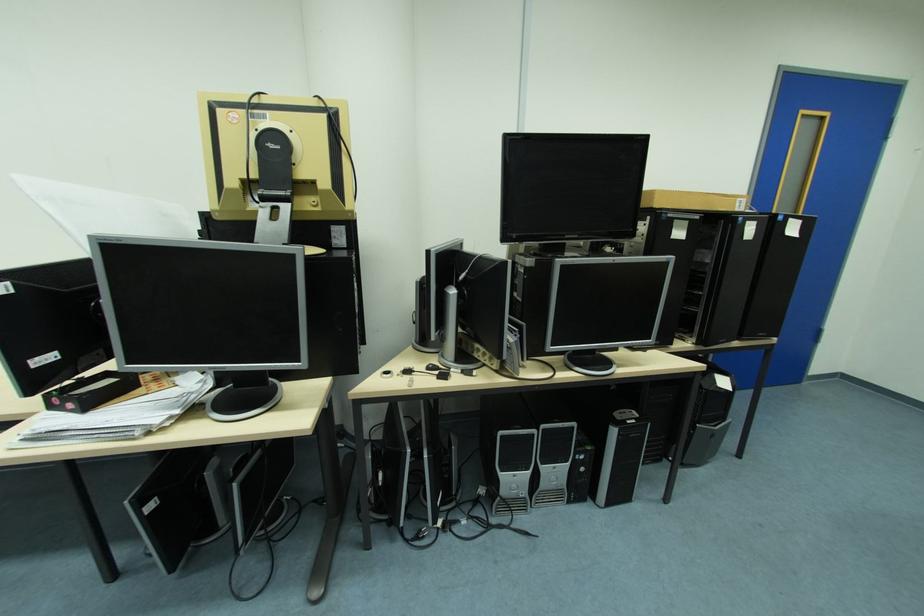
Identify the location of cardboard box. (691, 200).